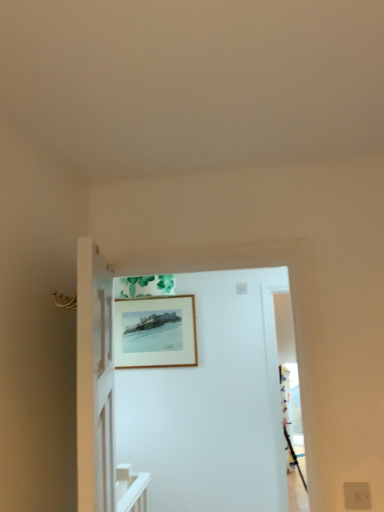
Question: Can you see white wooden door at center touching wooden picture frame at upper center?

Choices:
 (A) no
 (B) yes

Answer: (A)

Question: Is wooden picture frame at upper center at the back of white wooden door at center?

Choices:
 (A) yes
 (B) no

Answer: (A)

Question: Is white wooden door at center behind wooden picture frame at upper center?

Choices:
 (A) no
 (B) yes

Answer: (A)

Question: Is white wooden door at center to the left of wooden picture frame at upper center from the viewer's perspective?

Choices:
 (A) no
 (B) yes

Answer: (A)

Question: From a real-world perspective, is white wooden door at center physically above wooden picture frame at upper center?

Choices:
 (A) yes
 (B) no

Answer: (B)

Question: From the image's perspective, is white wooden door at center located above wooden picture frame at upper center?

Choices:
 (A) yes
 (B) no

Answer: (A)

Question: Considering the relative sizes of white matte electric outlet at lower right and white wooden door at center in the image provided, is white matte electric outlet at lower right smaller than white wooden door at center?

Choices:
 (A) no
 (B) yes

Answer: (B)

Question: From the image's perspective, would you say white matte electric outlet at lower right is shown under white wooden door at center?

Choices:
 (A) yes
 (B) no

Answer: (A)

Question: From the image's perspective, would you say white matte electric outlet at lower right is positioned over white wooden door at center?

Choices:
 (A) no
 (B) yes

Answer: (A)

Question: From a real-world perspective, does white matte electric outlet at lower right sit lower than white wooden door at center?

Choices:
 (A) no
 (B) yes

Answer: (B)

Question: Is white matte electric outlet at lower right far away from white wooden door at center?

Choices:
 (A) yes
 (B) no

Answer: (A)

Question: Does white matte electric outlet at lower right appear on the left side of white wooden door at center?

Choices:
 (A) yes
 (B) no

Answer: (B)

Question: Considering the relative sizes of white wooden door at center and white matte electric outlet at lower right in the image provided, is white wooden door at center shorter than white matte electric outlet at lower right?

Choices:
 (A) no
 (B) yes

Answer: (A)